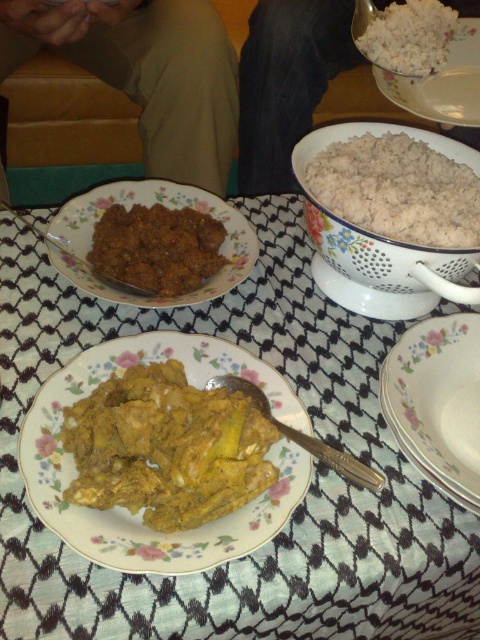
You are a guest at a dinner and want to reach for both the white matte rice at upper right and the white ceramic bowl at upper center. Which one would you need to stretch your hand further to reach?

You would need to stretch further to reach the white ceramic bowl at upper center because it is farther from the viewer compared to the white matte rice at upper right.

You are a guest at a dinner and want to reach for the white matte rice at upper right and the white ceramic bowl at upper center. Which one is closer to you?

The white matte rice at upper right is closer to you because it is shorter than the white ceramic bowl at upper center, meaning it is positioned nearer in the scene.

You are a guest at a dinner party and want to reach for the white fluffy rice at upper right without touching the brown fabric shirt at upper left. Is this possible based on their positions?

The brown fabric shirt at upper left is positioned over the white fluffy rice at upper right, so reaching for the white fluffy rice at upper right might require moving the brown fabric shirt at upper left first to avoid contact.